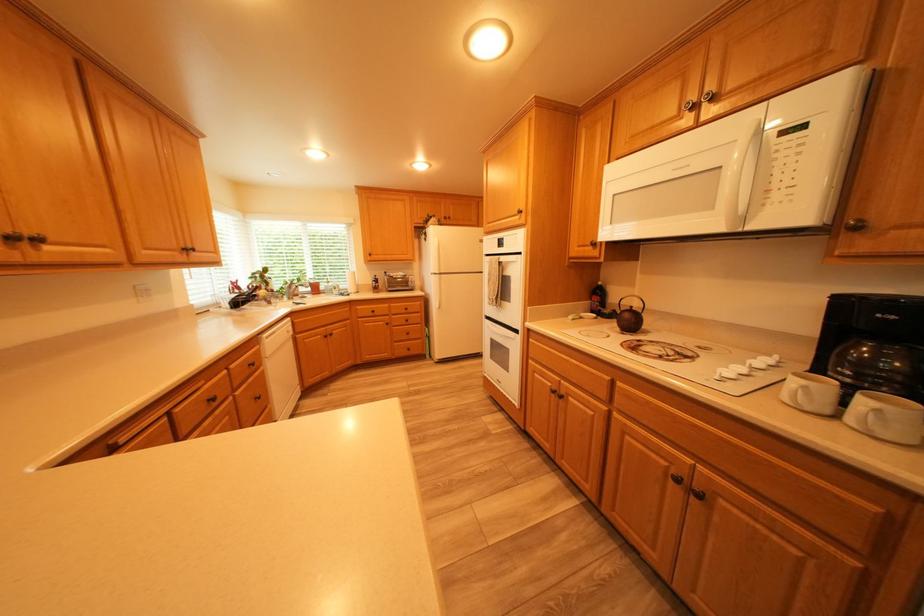
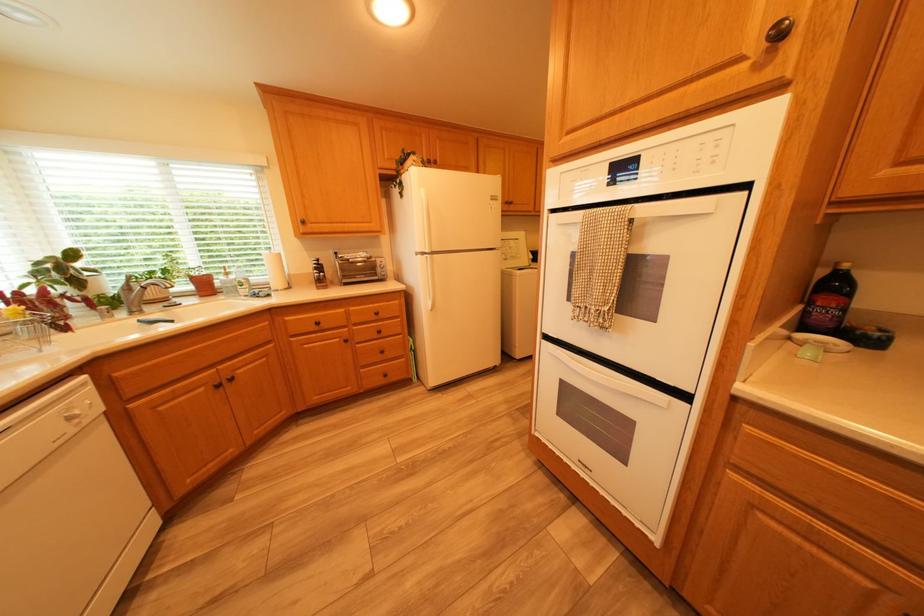
In the second image, find the point that corresponds to [606,301] in the first image.

(832, 305)